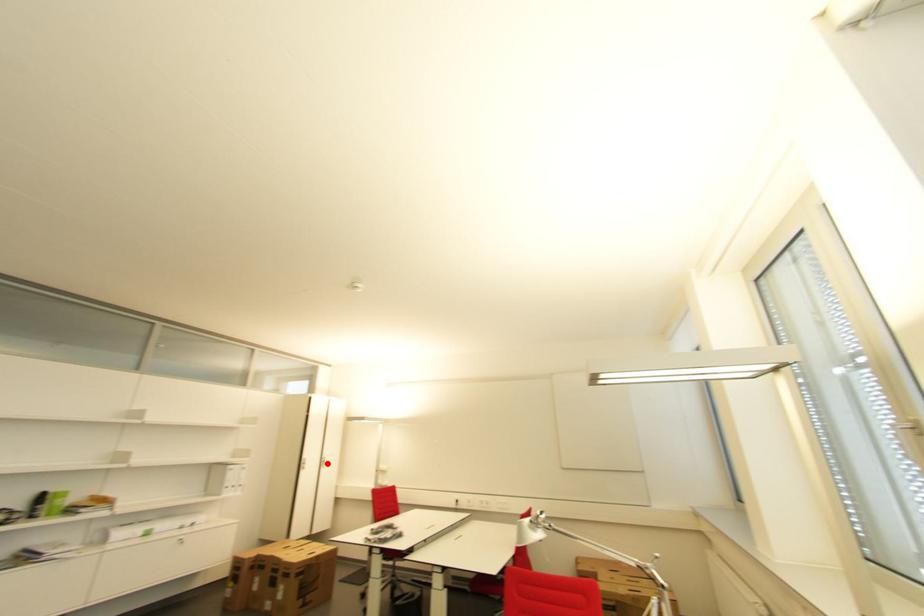
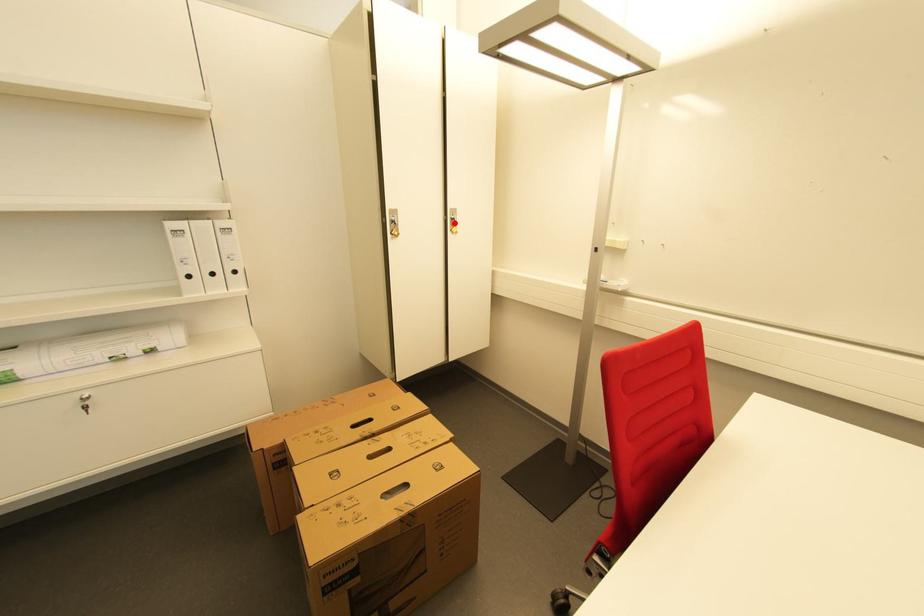
I am providing you with two images of the same scene from different viewpoints. A red point is marked on the first image and another point is marked on the second image. Is the red point in image1 aligned with the point shown in image2?

Yes